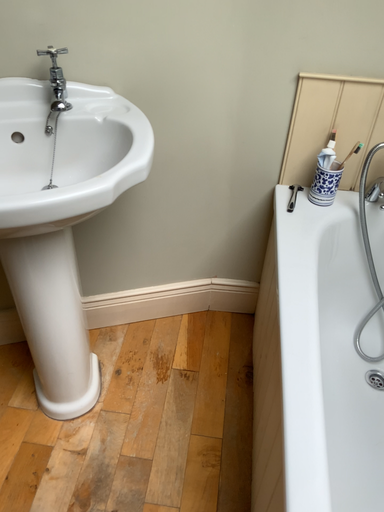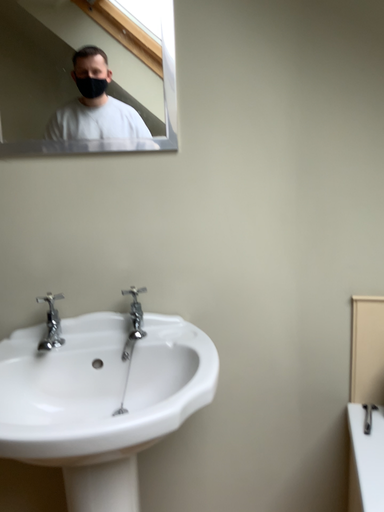
Question: How did the camera likely rotate when shooting the video?

Choices:
 (A) rotated right
 (B) rotated left

Answer: (B)